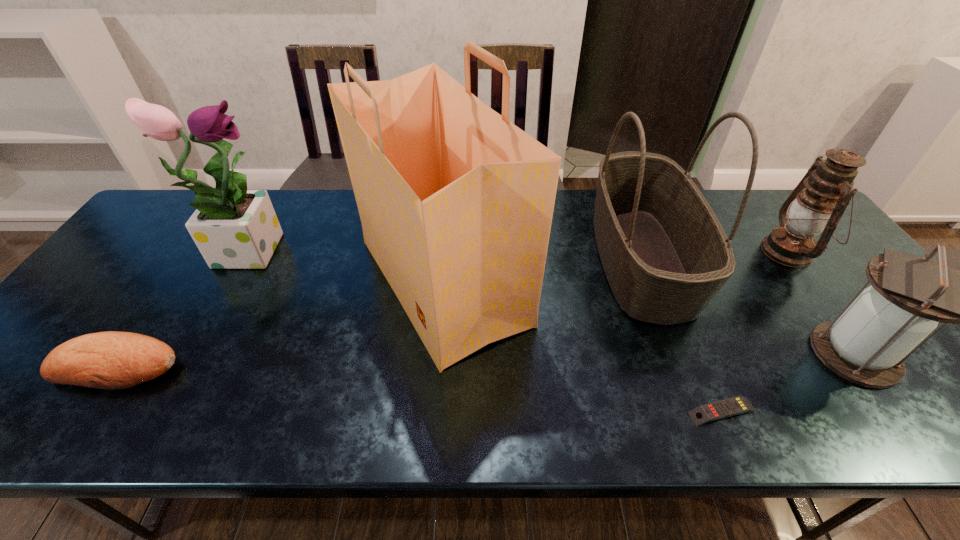
Where is `free spot located 0.180m on the front-facing side of the flower arrangement`? free spot located 0.180m on the front-facing side of the flower arrangement is located at coordinates 352,247.

Locate an element on the screen. free space located 0.320m on the left of the basket is located at coordinates (481, 259).

Locate an element on the screen. The height and width of the screenshot is (540, 960). free location located on the left of the lantern is located at coordinates (634, 252).

Where is `free space located 0.080m on the left of the lantern`? free space located 0.080m on the left of the lantern is located at coordinates (778, 354).

The image size is (960, 540). I want to click on vacant point located on the back of the bread, so 205,238.

Locate an element on the screen. The height and width of the screenshot is (540, 960). vacant area situated 0.360m on the right of the shortest object is located at coordinates (930, 411).

The height and width of the screenshot is (540, 960). Identify the location of grocery bag that is at the far edge. (456, 202).

Locate an element on the screen. Image resolution: width=960 pixels, height=540 pixels. flower arrangement present at the far edge is located at coordinates tap(234, 228).

Locate an element on the screen. The width and height of the screenshot is (960, 540). basket that is at the far edge is located at coordinates [665, 255].

The width and height of the screenshot is (960, 540). What are the coordinates of `lantern located at the far edge` in the screenshot? It's located at (818, 202).